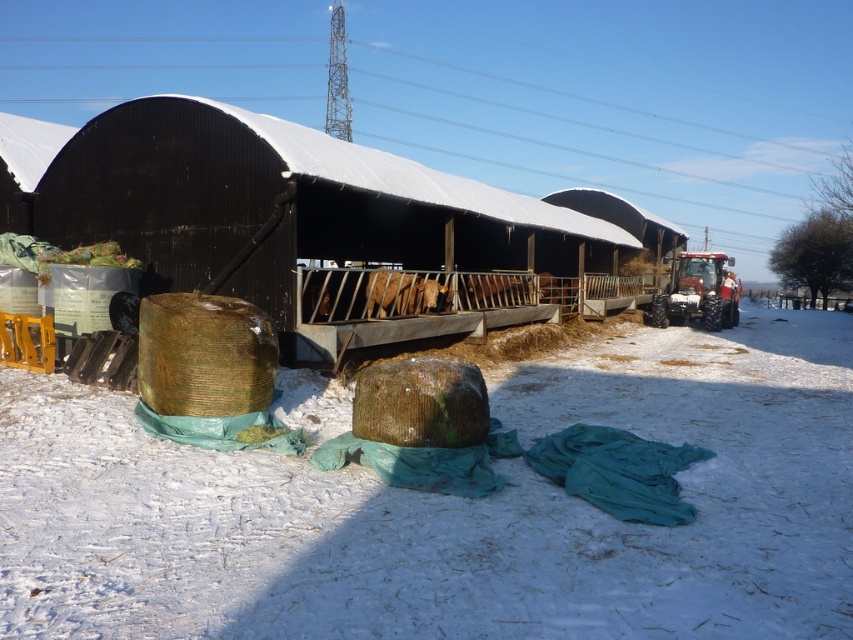
Which of these two, white fluffy snow at lower center or black corrugated metal barn at center, stands shorter?

white fluffy snow at lower center is shorter.

Measure the distance from white fluffy snow at lower center to black corrugated metal barn at center.

white fluffy snow at lower center and black corrugated metal barn at center are 5.84 meters apart.

Is point (387, 506) farther from viewer compared to point (398, 250)?

No.

The width and height of the screenshot is (853, 640). In order to click on white fluffy snow at lower center in this screenshot , I will do `click(451, 509)`.